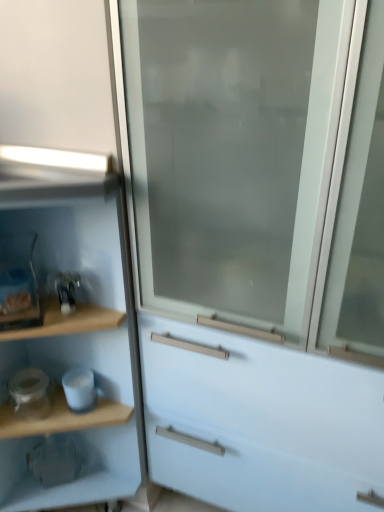
Question: Is wooden shelf at left not inside white glossy jar at lower left, which is counted as the 2th appliance, starting from the right?

Choices:
 (A) no
 (B) yes

Answer: (B)

Question: Is wooden shelf at left to the left of white glossy jar at lower left, which is counted as the first appliance, starting from the left, from the viewer's perspective?

Choices:
 (A) yes
 (B) no

Answer: (A)

Question: Is wooden shelf at left looking in the opposite direction of white glossy jar at lower left, which is counted as the first appliance, starting from the left?

Choices:
 (A) no
 (B) yes

Answer: (B)

Question: Can you confirm if wooden shelf at left is thinner than white glossy jar at lower left, which is counted as the 2th appliance, starting from the right?

Choices:
 (A) no
 (B) yes

Answer: (A)

Question: From the image's perspective, does wooden shelf at left appear lower than white glossy jar at lower left, which is counted as the 2th appliance, starting from the right?

Choices:
 (A) yes
 (B) no

Answer: (B)

Question: Does wooden shelf at left have a smaller size compared to white glossy jar at lower left, which is counted as the 2th appliance, starting from the right?

Choices:
 (A) no
 (B) yes

Answer: (A)

Question: Considering the relative sizes of frosted glass screen door at center and white glossy mug at lower left, which appears as the second appliance when viewed from the left, in the image provided, is frosted glass screen door at center smaller than white glossy mug at lower left, which appears as the second appliance when viewed from the left,?

Choices:
 (A) no
 (B) yes

Answer: (A)

Question: Is frosted glass screen door at center facing towards white glossy mug at lower left, which appears as the second appliance when viewed from the left?

Choices:
 (A) yes
 (B) no

Answer: (B)

Question: Can you confirm if frosted glass screen door at center is wider than white glossy mug at lower left, which is the first appliance in right-to-left order?

Choices:
 (A) yes
 (B) no

Answer: (A)

Question: Can you confirm if frosted glass screen door at center is bigger than white glossy mug at lower left, which appears as the second appliance when viewed from the left?

Choices:
 (A) yes
 (B) no

Answer: (A)

Question: Is frosted glass screen door at center in front of white glossy mug at lower left, which is the first appliance in right-to-left order?

Choices:
 (A) no
 (B) yes

Answer: (B)

Question: Could white glossy mug at lower left, which appears as the second appliance when viewed from the left, be considered to be inside frosted glass screen door at center?

Choices:
 (A) yes
 (B) no

Answer: (B)

Question: Considering the relative sizes of white glossy jar at lower left, which is counted as the first appliance, starting from the left, and wooden shelf at left in the image provided, is white glossy jar at lower left, which is counted as the first appliance, starting from the left, wider than wooden shelf at left?

Choices:
 (A) no
 (B) yes

Answer: (A)